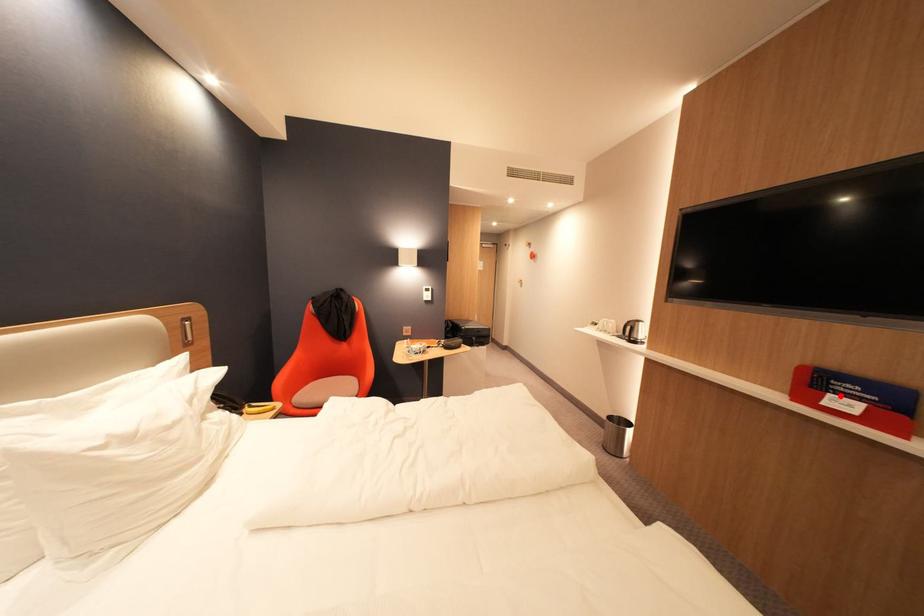
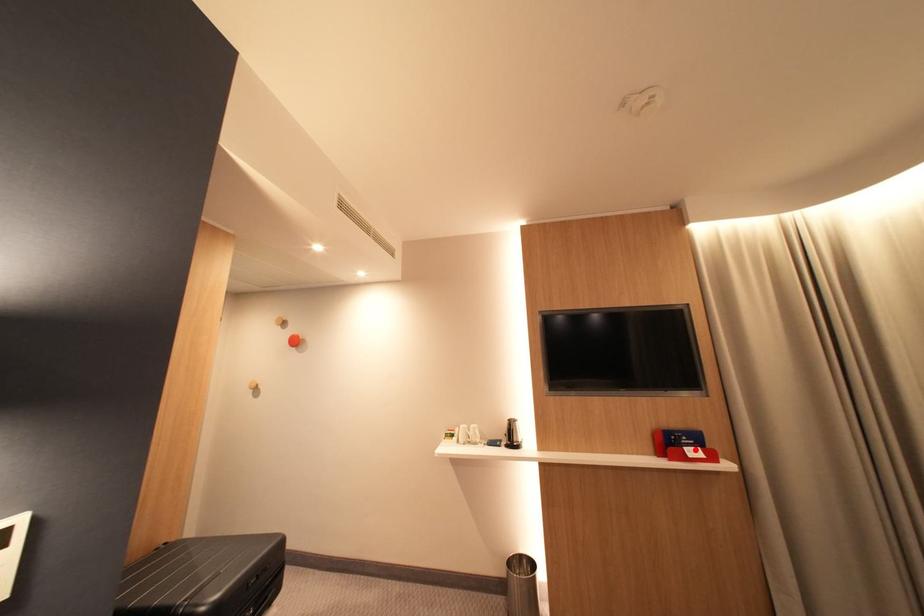
I am providing you with two images of the same scene from different viewpoints. A red point is marked on the first image and another point is marked on the second image. Does the point marked in image1 correspond to the same location as the one in image2?

Yes